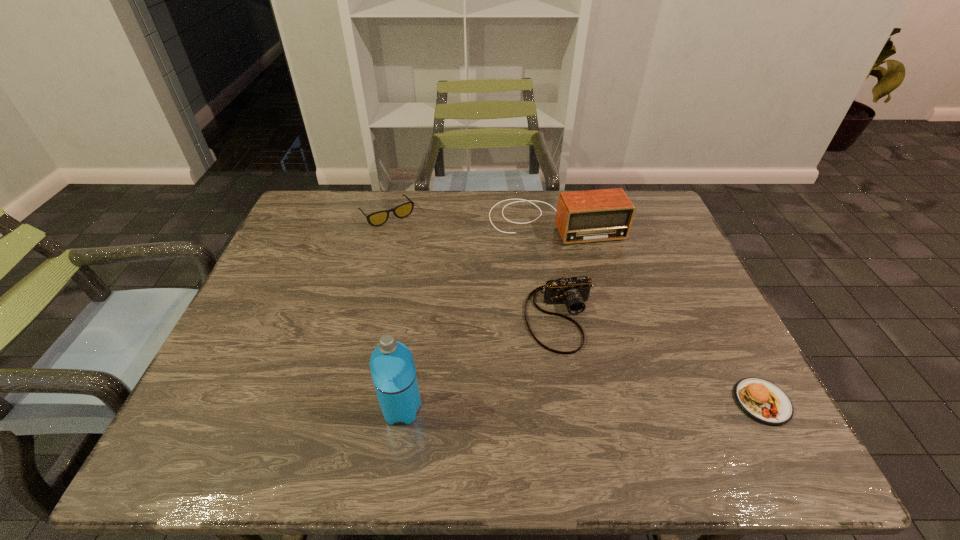
Locate an element on the screen. The image size is (960, 540). blank space located 0.060m on the front-facing side of the camera is located at coordinates (578, 376).

Find the location of a particular element. blank area located 0.050m on the front-facing side of the sunglasses is located at coordinates (406, 236).

In order to click on vacant space located 0.320m on the front-facing side of the sunglasses in this screenshot , I will do `click(448, 289)`.

Locate an element on the screen. The height and width of the screenshot is (540, 960). free spot located on the front-facing side of the sunglasses is located at coordinates (455, 299).

Identify the location of blank space located on the front-facing side of the fourth shortest object. (588, 291).

I want to click on blank space located 0.130m on the front-facing side of the fourth shortest object, so click(582, 275).

Identify the location of vacant space located 0.400m on the front-facing side of the fourth shortest object. (616, 355).

At what (x,y) coordinates should I click in order to perform the action: click on sunglasses that is at the far edge. Please return your answer as a coordinate pair (x, y). This screenshot has height=540, width=960. Looking at the image, I should click on (375, 219).

Where is `radio receiver at the far edge`? The image size is (960, 540). radio receiver at the far edge is located at coordinates (595, 215).

Identify the location of thermos bottle situated at the near edge. (393, 372).